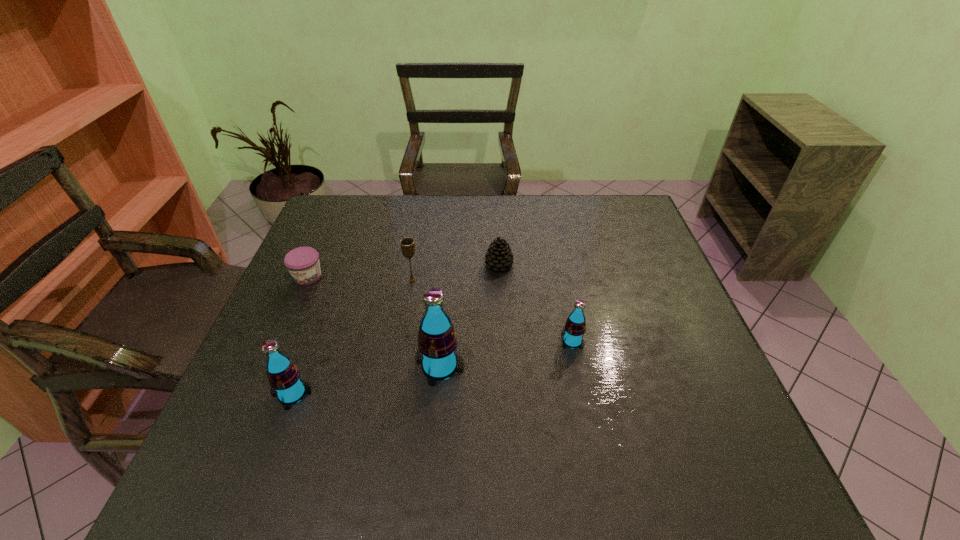
You are a GUI agent. You are given a task and a screenshot of the screen. Output one action in this format:
    pyautogui.click(x=<x>, y=<y>)
    Task: Click on the second shortest soda
    
    Given the screenshot: What is the action you would take?
    [284, 377]

The image size is (960, 540). What are the coordinates of `the second tallest object` in the screenshot? It's located at point(284,377).

At what (x,y) coordinates should I click in order to perform the action: click on the fourth object from left to right. Please return your answer as a coordinate pair (x, y). The width and height of the screenshot is (960, 540). Looking at the image, I should click on (437, 343).

The image size is (960, 540). Identify the location of the second soda from left to right. (437, 343).

This screenshot has height=540, width=960. What are the coordinates of `the shortest soda` in the screenshot? It's located at (575, 326).

I want to click on the rightmost object, so click(x=575, y=326).

The height and width of the screenshot is (540, 960). Identify the location of the third object from left to right. (407, 244).

At what (x,y) coordinates should I click in order to perform the action: click on jam. Please return your answer as a coordinate pair (x, y). Looking at the image, I should click on (303, 263).

Find the location of a particular element. This screenshot has height=540, width=960. pinecone is located at coordinates [x=498, y=256].

The height and width of the screenshot is (540, 960). I want to click on the second object from right to left, so click(x=498, y=256).